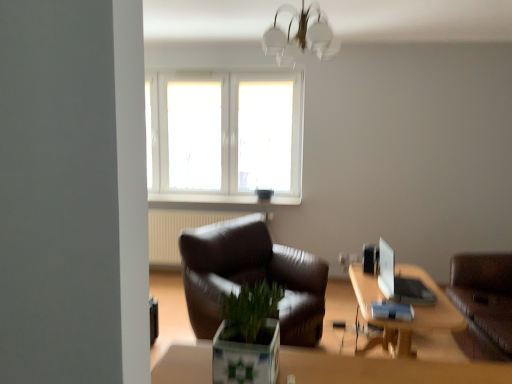
Question: Is wooden table at lower right inside or outside of green matte plant at center?

Choices:
 (A) outside
 (B) inside

Answer: (A)

Question: Visually, is wooden table at lower right positioned to the left or to the right of green matte plant at center?

Choices:
 (A) left
 (B) right

Answer: (B)

Question: Which object is positioned closest to the brown leather couch at right?

Choices:
 (A) green matte plant at center
 (B) wooden table at lower right
 (C) white frosted glass chandelier at upper center
 (D) white glossy monitor at upper right
 (E) white plastic window at upper center

Answer: (B)

Question: Which object is positioned closest to the white glossy monitor at upper right?

Choices:
 (A) brown leather couch at right
 (B) wooden table at lower right
 (C) green matte plant at center
 (D) white plastic window at upper center
 (E) white frosted glass chandelier at upper center

Answer: (B)